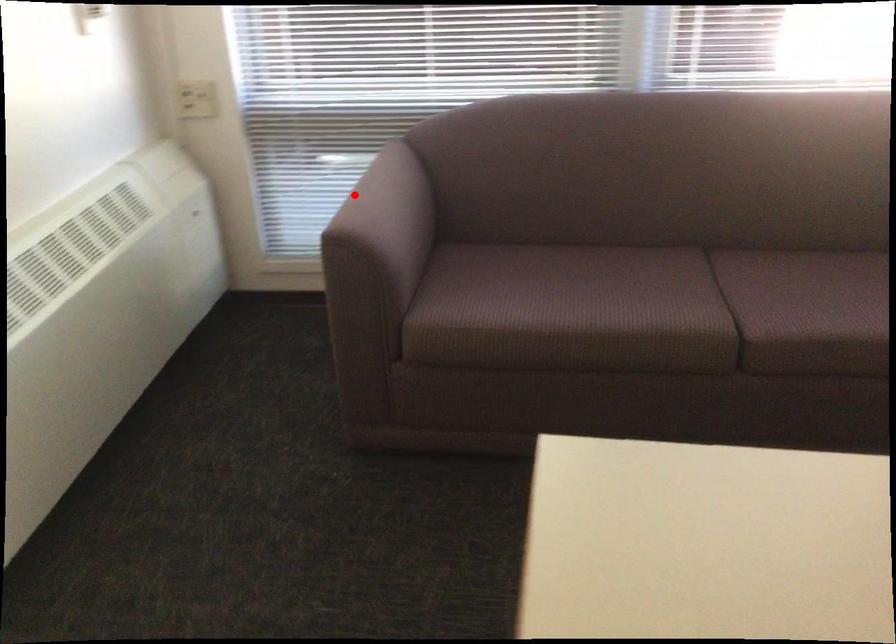
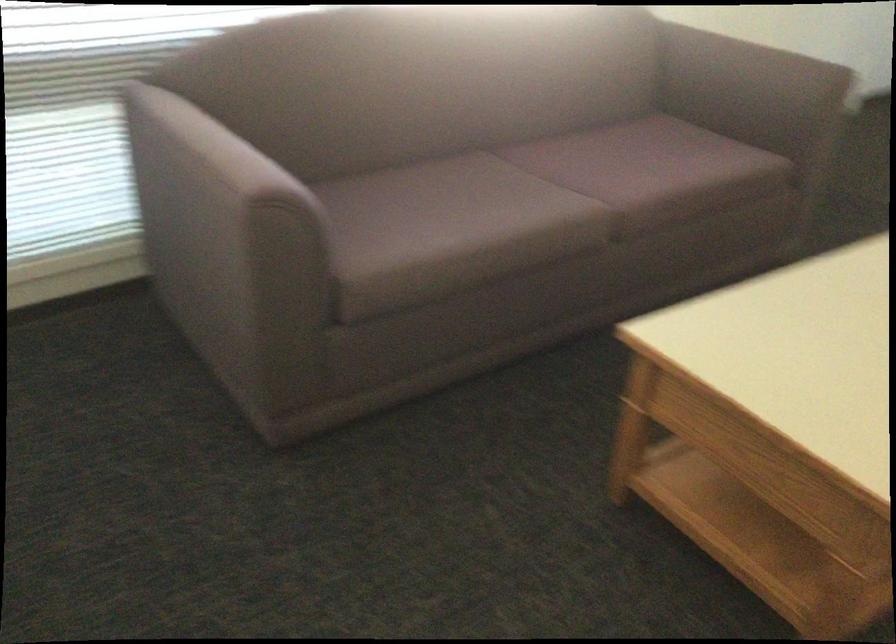
Question: I am providing you with two images of the same scene from different viewpoints. In image1, a red point is highlighted. Considering the same 3D point in image2, which of the following is correct?

Choices:
 (A) It is closer
 (B) It is farther

Answer: (A)